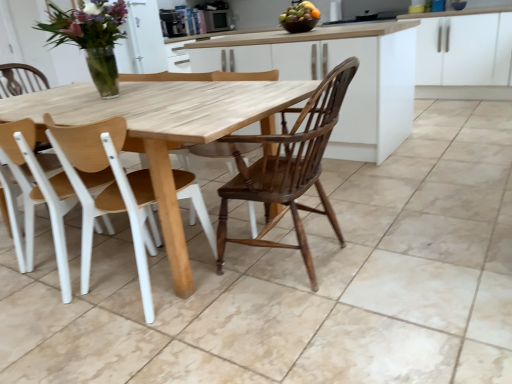
The width and height of the screenshot is (512, 384). Identify the location of free spot to the right of wooden at center, the 2th chair viewed from the left. (232, 287).